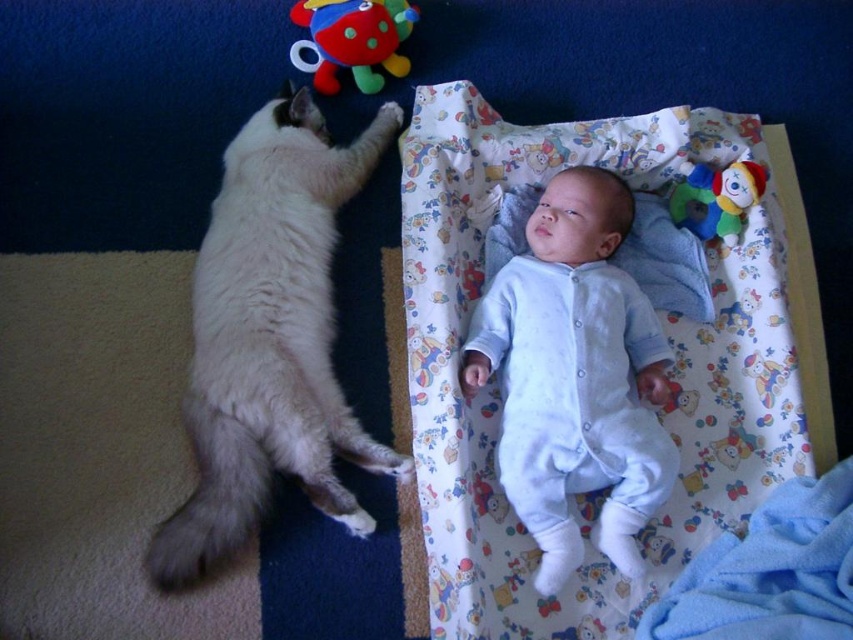
You are a parent checking the playpen setup. You notice the fluffy white blanket at upper right and the light blue cotton onesie at center. Which object is taller?

The fluffy white blanket at upper right is much taller than the light blue cotton onesie at center.

You are a parent trying to place a toy for your baby. The baby is in the playpen, and you have two points to choose from. The first point is at point (x=265, y=198) and the second is at point (x=345, y=12). Which point is closer to the baby?

Point (x=265, y=198) is in front of point (x=345, y=12), so it is closer to the baby.